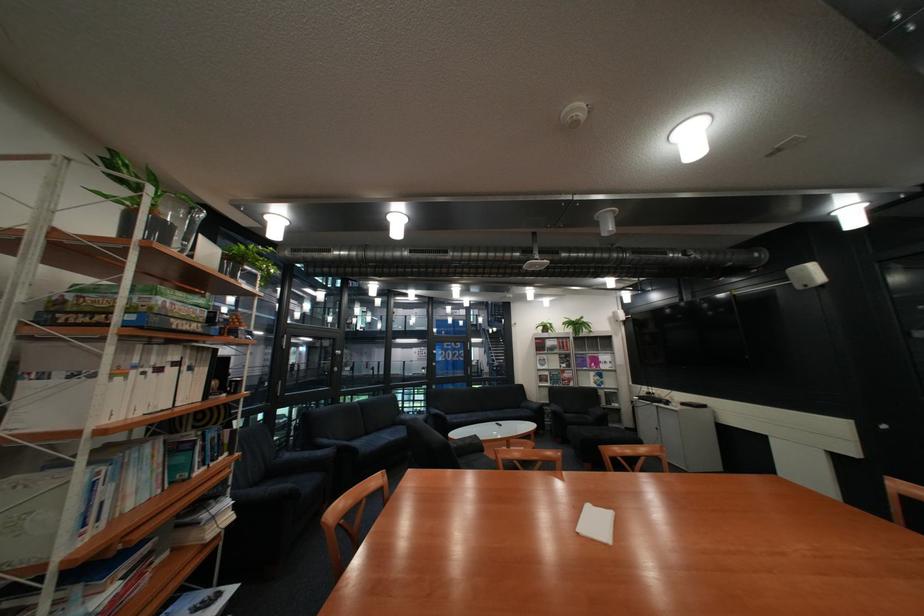
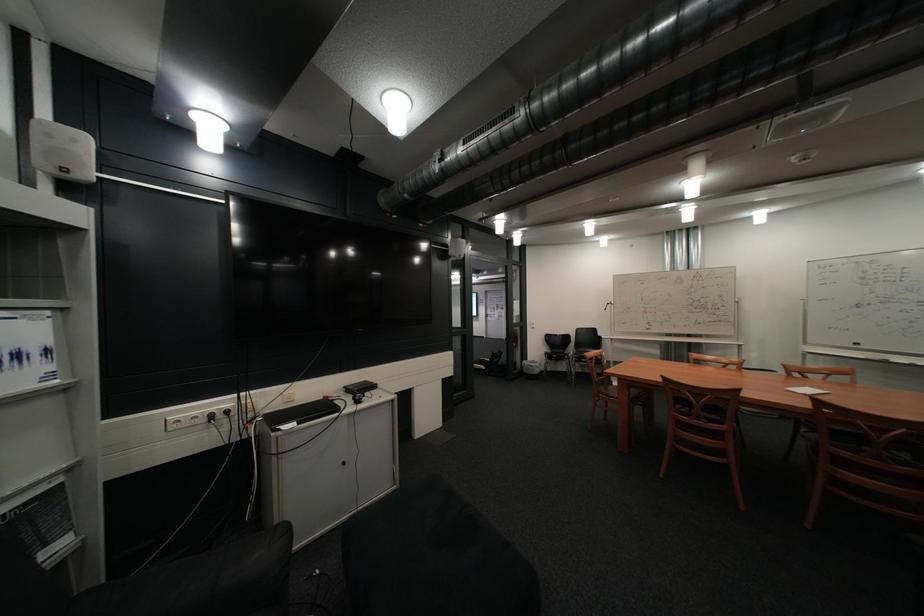
Where in the second image is the point corresponding to point 623,369 from the first image?

(46, 386)